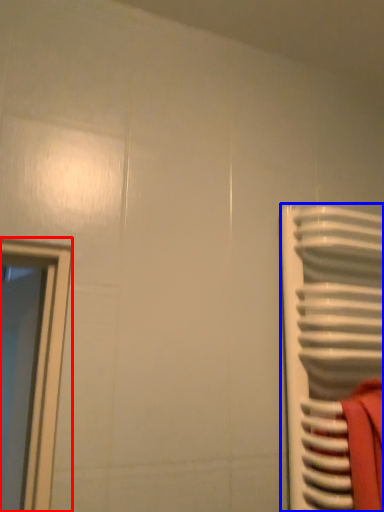
Question: Which of the following is the farthest to the observer, window (highlighted by a red box) or radiator (highlighted by a blue box)?

Choices:
 (A) window
 (B) radiator

Answer: (A)